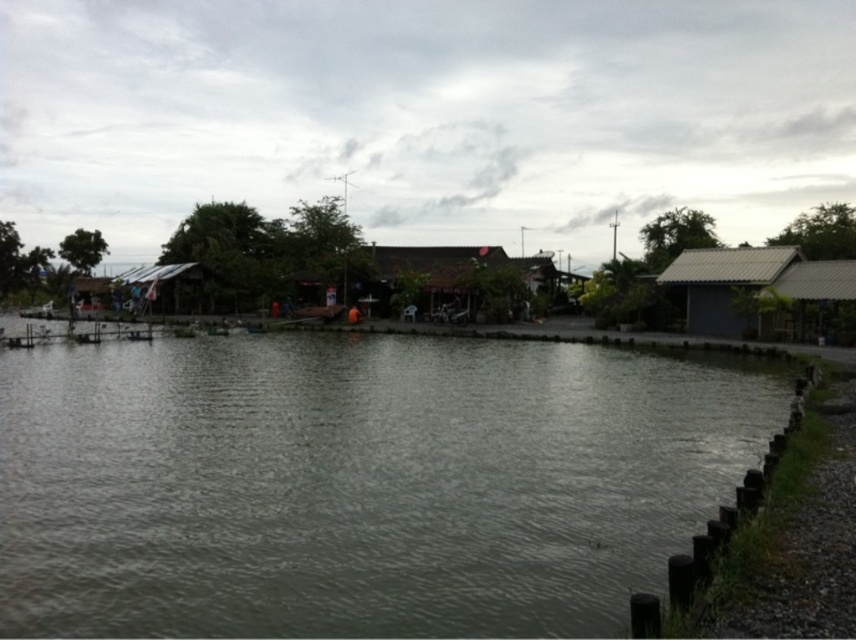
Who is taller, gray water at center or gray corrugated metal hut at right?

gray corrugated metal hut at right

Can you confirm if gray water at center is positioned to the right of gray corrugated metal hut at right?

In fact, gray water at center is to the left of gray corrugated metal hut at right.

This screenshot has width=856, height=640. In order to click on gray water at center in this screenshot , I will do `click(360, 483)`.